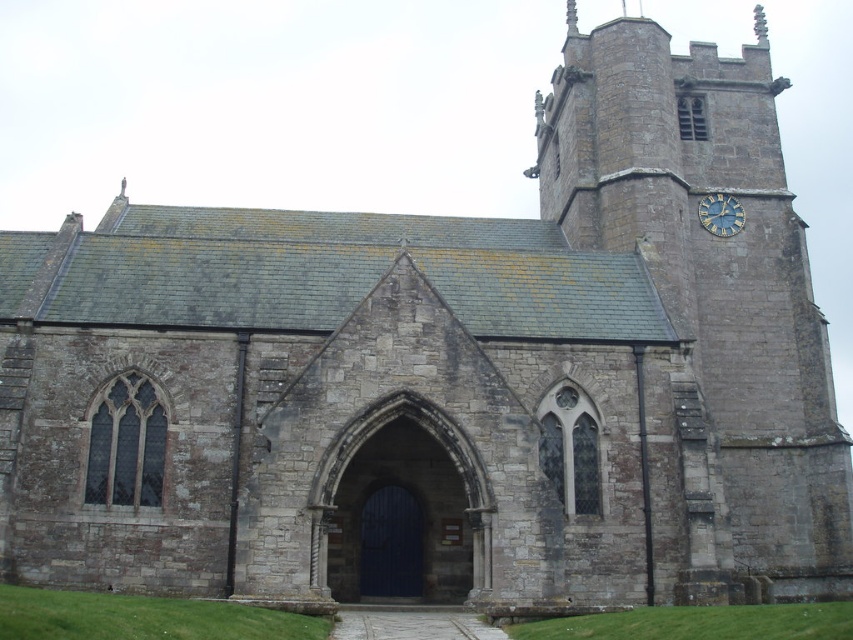
Question: Which point is farther from the camera taking this photo?

Choices:
 (A) (793, 416)
 (B) (728, 202)

Answer: (B)

Question: Which object is closer to the camera taking this photo?

Choices:
 (A) gold metallic clock at upper right
 (B) stone clock tower at right

Answer: (B)

Question: Is stone clock tower at right smaller than gold metallic clock at upper right?

Choices:
 (A) yes
 (B) no

Answer: (B)

Question: Does stone clock tower at right have a lesser width compared to gold metallic clock at upper right?

Choices:
 (A) no
 (B) yes

Answer: (A)

Question: Does stone clock tower at right have a smaller size compared to gold metallic clock at upper right?

Choices:
 (A) no
 (B) yes

Answer: (A)

Question: Which point is closer to the camera?

Choices:
 (A) stone clock tower at right
 (B) gold metallic clock at upper right

Answer: (A)